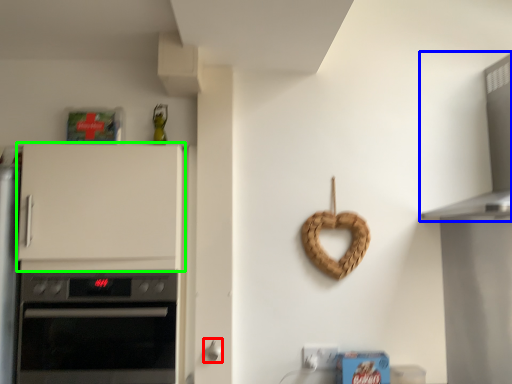
Question: Based on their relative distances, which object is farther from door handle (highlighted by a red box)? Choose from vent (highlighted by a blue box) and cabinetry (highlighted by a green box).

Choices:
 (A) vent
 (B) cabinetry

Answer: (A)